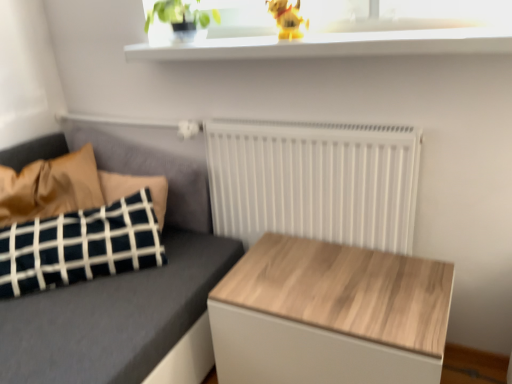
This screenshot has height=384, width=512. I want to click on vacant space situated above white matte radiator at center (from a real-world perspective), so click(x=306, y=120).